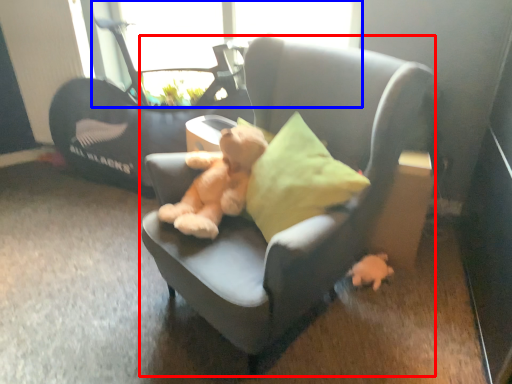
Question: Which point is further to the camera, chair (highlighted by a red box) or window screen (highlighted by a blue box)?

Choices:
 (A) chair
 (B) window screen

Answer: (B)